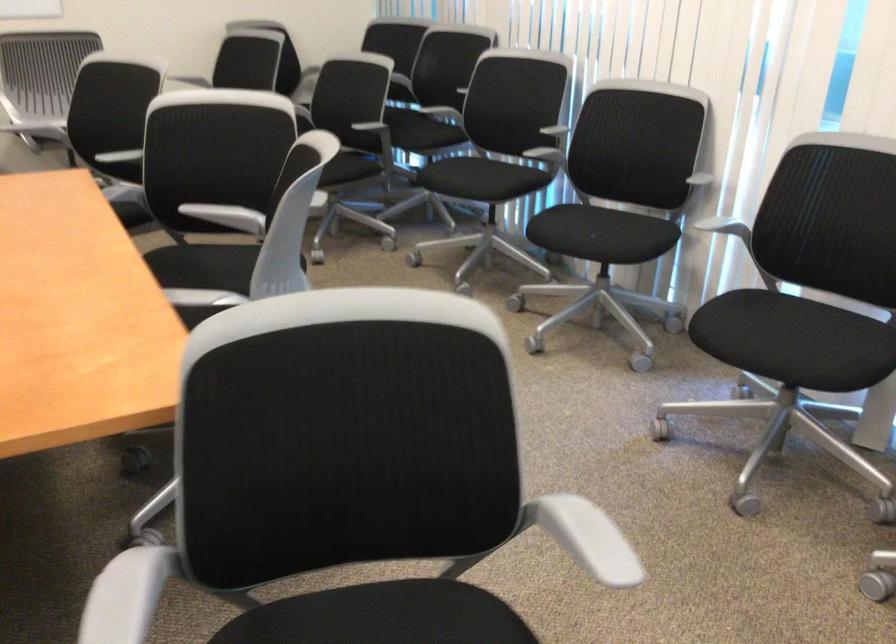
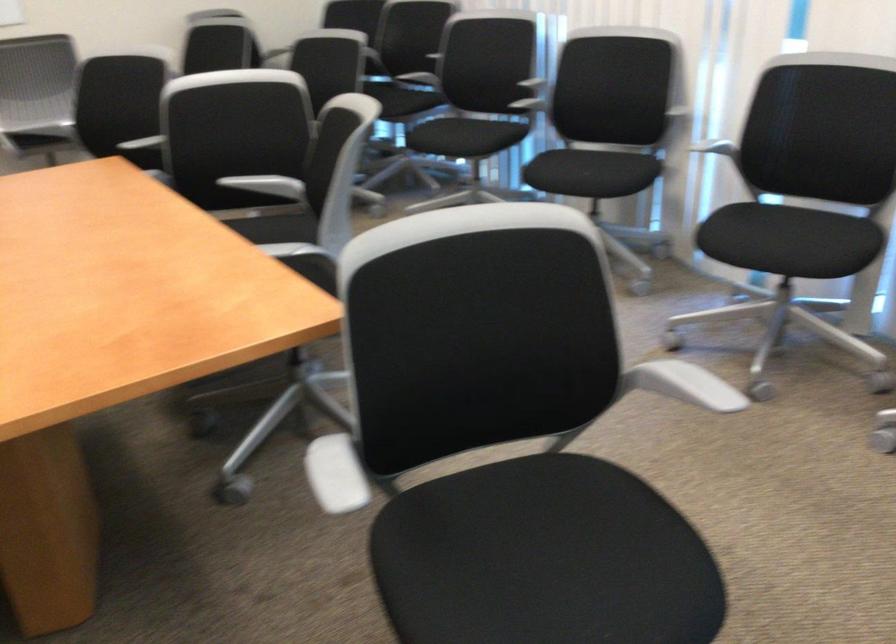
Find the pixel in the second image that matches (728,232) in the first image.

(718, 149)